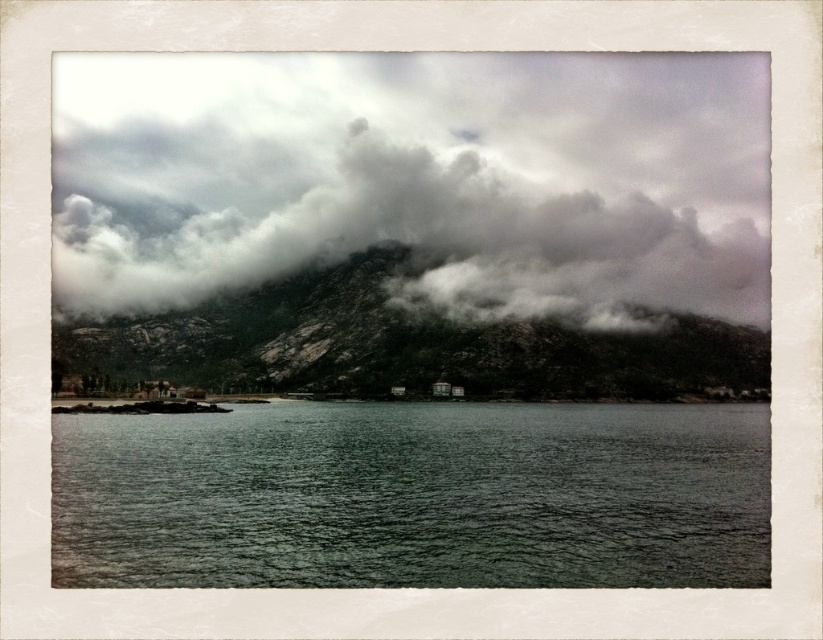
You are standing on the beach looking at the scene. Which object is positioned higher in the image, the cloudy gray sky at upper center or the rocky gray mountain at center?

The cloudy gray sky at upper center is positioned higher in the image than the rocky gray mountain at center because it is described as being above it.